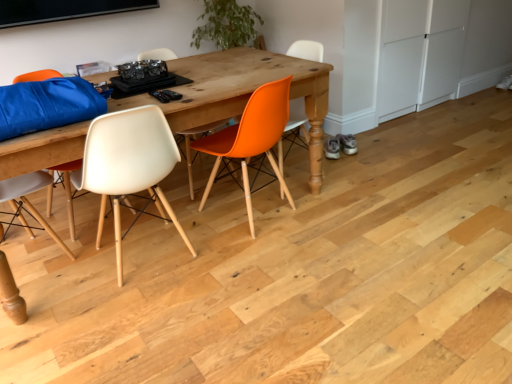
Describe the element at coordinates (128, 165) in the screenshot. I see `white matte chair at center, the 1th chair positioned from the left` at that location.

Image resolution: width=512 pixels, height=384 pixels. In order to click on orange matte chair at center, which ranks as the first chair in right-to-left order in this screenshot , I will do `click(312, 121)`.

What is the approximate width of wooden table at center?

It is 35.56 inches.

What do you see at coordinates (251, 139) in the screenshot?
I see `orange matte chair at center, which is counted as the 2th chair, starting from the left` at bounding box center [251, 139].

Based on the photo, how much space does orange matte chair at center, which is counted as the 2th chair, starting from the left, occupy vertically?

It is 79.10 centimeters.

Identify the location of white matte chair at center, the 1th chair positioned from the left. The width and height of the screenshot is (512, 384). (128, 165).

From the image's perspective, is white matte cabinet at right under wooden table at center?

No, from the image's perspective, white matte cabinet at right is not beneath wooden table at center.

From a real-world perspective, who is located higher, white matte cabinet at right or wooden table at center?

white matte cabinet at right.

Measure the distance between white matte cabinet at right and wooden table at center.

4.94 feet.

Is white matte cabinet at right positioned in front of wooden table at center?

No, it is behind wooden table at center.

Consider the image. Between wooden table at center and orange matte chair at center, positioned as the 3th chair in left-to-right order, which one has smaller width?

With smaller width is orange matte chair at center, positioned as the 3th chair in left-to-right order.

Can you see wooden table at center touching orange matte chair at center, which ranks as the first chair in right-to-left order?

wooden table at center and orange matte chair at center, which ranks as the first chair in right-to-left order, are clearly separated.

Can you confirm if wooden table at center is taller than orange matte chair at center, positioned as the 3th chair in left-to-right order?

No.

Can we say wooden table at center lies outside orange matte chair at center, positioned as the 3th chair in left-to-right order?

Yes, wooden table at center is located beyond the bounds of orange matte chair at center, positioned as the 3th chair in left-to-right order.

From the picture: Based on their sizes in the image, would you say wooden table at center is bigger or smaller than orange matte chair at center, arranged as the second chair when viewed from the right?

wooden table at center is bigger than orange matte chair at center, arranged as the second chair when viewed from the right.

From a real-world perspective, is wooden table at center on orange matte chair at center, arranged as the second chair when viewed from the right?

No.

Is wooden table at center next to orange matte chair at center, which is counted as the 2th chair, starting from the left, and touching it?

No, wooden table at center is not in contact with orange matte chair at center, which is counted as the 2th chair, starting from the left.

Do you think wooden table at center is within orange matte chair at center, arranged as the second chair when viewed from the right, or outside of it?

wooden table at center is not enclosed by orange matte chair at center, arranged as the second chair when viewed from the right.

Considering the sizes of objects orange matte chair at center, which ranks as the first chair in right-to-left order, and orange matte chair at center, arranged as the second chair when viewed from the right, in the image provided, who is taller, orange matte chair at center, which ranks as the first chair in right-to-left order, or orange matte chair at center, arranged as the second chair when viewed from the right,?

Standing taller between the two is orange matte chair at center, which ranks as the first chair in right-to-left order.

What are the coordinates of `the 1st chair below the orange matte chair at center, positioned as the 3th chair in left-to-right order (from the image's perspective)` in the screenshot? It's located at (251, 139).

Considering the sizes of orange matte chair at center, which ranks as the first chair in right-to-left order, and orange matte chair at center, which is counted as the 2th chair, starting from the left, in the image, is orange matte chair at center, which ranks as the first chair in right-to-left order, wider or thinner than orange matte chair at center, which is counted as the 2th chair, starting from the left,?

In the image, orange matte chair at center, which ranks as the first chair in right-to-left order, appears to be more narrow than orange matte chair at center, which is counted as the 2th chair, starting from the left.

How different are the orientations of orange matte chair at center, positioned as the 3th chair in left-to-right order, and orange matte chair at center, arranged as the second chair when viewed from the right, in degrees?

75.2 degrees.

In the scene shown: From the image's perspective, which one is positioned higher, white matte chair at center, the 1th chair positioned from the left, or orange matte chair at center, which ranks as the first chair in right-to-left order?

orange matte chair at center, which ranks as the first chair in right-to-left order.

Which is less distant, (91, 128) or (308, 55)?

Point (91, 128)

From the picture: Does white matte chair at center, which ranks as the 3th chair in right-to-left order, have a lesser width compared to orange matte chair at center, positioned as the 3th chair in left-to-right order?

No, white matte chair at center, which ranks as the 3th chair in right-to-left order, is not thinner than orange matte chair at center, positioned as the 3th chair in left-to-right order.

The width and height of the screenshot is (512, 384). What are the coordinates of `the 2nd chair counting from the left of the orange matte chair at center, positioned as the 3th chair in left-to-right order` in the screenshot? It's located at (128, 165).

Which point is more distant from viewer, (86,164) or (192,57)?

Point (192,57)

Which of these two, white matte chair at center, the 1th chair positioned from the left, or wooden table at center, is thinner?

Thinner between the two is white matte chair at center, the 1th chair positioned from the left.

Would you say white matte chair at center, which ranks as the 3th chair in right-to-left order, is inside or outside wooden table at center?

white matte chair at center, which ranks as the 3th chair in right-to-left order, is enclosed within wooden table at center.

From the image's perspective, which is below, white matte chair at center, the 1th chair positioned from the left, or wooden table at center?

white matte chair at center, the 1th chair positioned from the left, from the image's perspective.

Can you confirm if orange matte chair at center, which ranks as the first chair in right-to-left order, is wider than white matte chair at center, which ranks as the 3th chair in right-to-left order?

Incorrect, the width of orange matte chair at center, which ranks as the first chair in right-to-left order, does not surpass that of white matte chair at center, which ranks as the 3th chair in right-to-left order.

Is orange matte chair at center, positioned as the 3th chair in left-to-right order, oriented away from white matte chair at center, the 1th chair positioned from the left?

That's not correct — orange matte chair at center, positioned as the 3th chair in left-to-right order, is not looking away from white matte chair at center, the 1th chair positioned from the left.

From the image's perspective, is orange matte chair at center, positioned as the 3th chair in left-to-right order, above or below white matte chair at center, which ranks as the 3th chair in right-to-left order?

Clearly, from the image's perspective, orange matte chair at center, positioned as the 3th chair in left-to-right order, is above white matte chair at center, which ranks as the 3th chair in right-to-left order.

This screenshot has width=512, height=384. I want to click on cabinetry on the right of wooden table at center, so click(x=419, y=54).

In the image, there is a orange matte chair at center, which ranks as the first chair in right-to-left order. Where is `table below it (from a real-world perspective)`? This screenshot has height=384, width=512. table below it (from a real-world perspective) is located at coordinates (242, 92).

Considering their positions, is orange matte chair at center, which is counted as the 2th chair, starting from the left, positioned closer to orange matte chair at center, positioned as the 3th chair in left-to-right order, than white matte chair at center, the 1th chair positioned from the left?

orange matte chair at center, which is counted as the 2th chair, starting from the left, lies closer to orange matte chair at center, positioned as the 3th chair in left-to-right order, than the other object.

Estimate the real-world distances between objects in this image. Which object is further from orange matte chair at center, arranged as the second chair when viewed from the right, white matte cabinet at right or orange matte chair at center, which ranks as the first chair in right-to-left order?

white matte cabinet at right is further to orange matte chair at center, arranged as the second chair when viewed from the right.

Which object lies further to the anchor point orange matte chair at center, which is counted as the 2th chair, starting from the left, wooden table at center or white matte cabinet at right?

Among the two, white matte cabinet at right is located further to orange matte chair at center, which is counted as the 2th chair, starting from the left.

Based on their spatial positions, is white matte chair at center, the 1th chair positioned from the left, or wooden table at center further from white matte cabinet at right?

white matte chair at center, the 1th chair positioned from the left, is positioned further to the anchor white matte cabinet at right.

From the image, which object appears to be nearer to white matte cabinet at right, orange matte chair at center, positioned as the 3th chair in left-to-right order, or white matte chair at center, the 1th chair positioned from the left?

Based on the image, orange matte chair at center, positioned as the 3th chair in left-to-right order, appears to be nearer to white matte cabinet at right.

Estimate the real-world distances between objects in this image. Which object is further from white matte chair at center, the 1th chair positioned from the left, orange matte chair at center, arranged as the second chair when viewed from the right, or wooden table at center?

orange matte chair at center, arranged as the second chair when viewed from the right.

When comparing their distances from white matte chair at center, the 1th chair positioned from the left, does orange matte chair at center, which ranks as the first chair in right-to-left order, or white matte cabinet at right seem closer?

orange matte chair at center, which ranks as the first chair in right-to-left order, is positioned closer to the anchor white matte chair at center, the 1th chair positioned from the left.

Looking at this image, looking at the image, which one is located closer to orange matte chair at center, positioned as the 3th chair in left-to-right order, orange matte chair at center, arranged as the second chair when viewed from the right, or white matte cabinet at right?

The object closer to orange matte chair at center, positioned as the 3th chair in left-to-right order, is orange matte chair at center, arranged as the second chair when viewed from the right.

Locate an element on the screen. The image size is (512, 384). table situated between white matte chair at center, the 1th chair positioned from the left, and orange matte chair at center, which is counted as the 2th chair, starting from the left, from left to right is located at coordinates (242, 92).

The image size is (512, 384). I want to click on chair situated between white matte chair at center, the 1th chair positioned from the left, and orange matte chair at center, which ranks as the first chair in right-to-left order, from left to right, so click(251, 139).

At what (x,y) coordinates should I click in order to perform the action: click on table between white matte chair at center, which ranks as the 3th chair in right-to-left order, and white matte cabinet at right, in the horizontal direction. Please return your answer as a coordinate pair (x, y). Looking at the image, I should click on (242, 92).

The image size is (512, 384). I want to click on chair located between orange matte chair at center, arranged as the second chair when viewed from the right, and white matte cabinet at right in the left-right direction, so click(x=312, y=121).